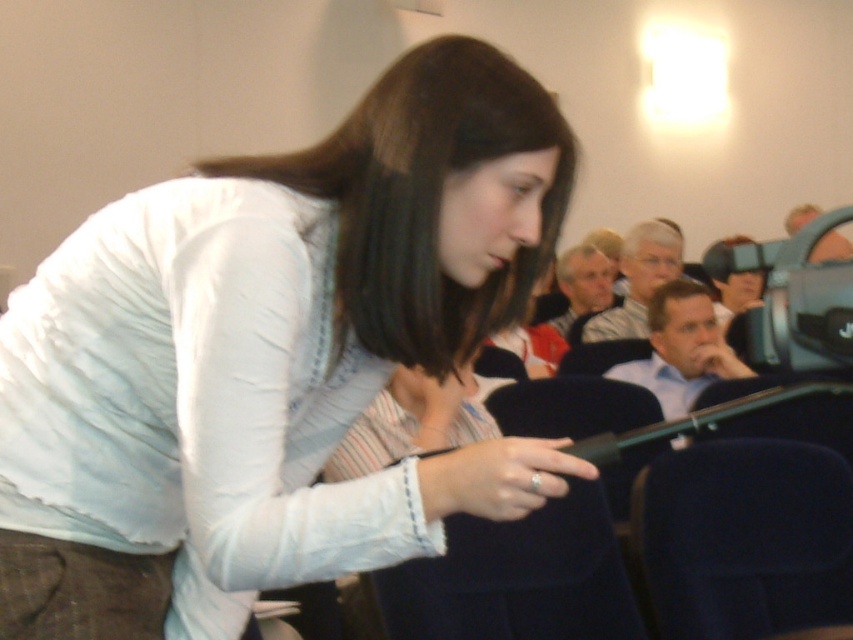
Between white matte shirt at center and black plastic video camera at upper right, which one has less height?

black plastic video camera at upper right

Does point (555, 150) come farther from viewer compared to point (718, 244)?

No, (555, 150) is in front of (718, 244).

Is point (248, 547) positioned before point (819, 342)?

No, (248, 547) is behind (819, 342).

Find the location of `white matte shirt at center`. white matte shirt at center is located at coordinates (271, 358).